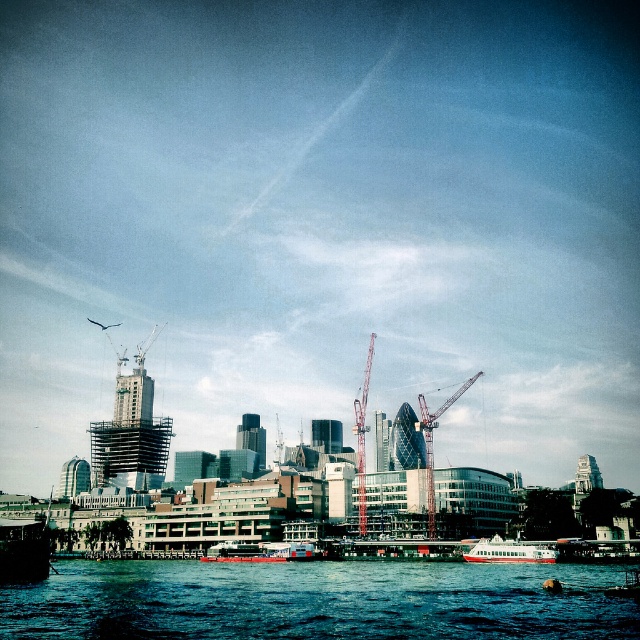
Question: Which point is closer to the camera?

Choices:
 (A) (634, 579)
 (B) (429, 440)
 (C) (509, 545)
 (D) (237, 608)

Answer: (D)

Question: Is white glossy boat at lower center wider than metallic silver boat at lower right?

Choices:
 (A) no
 (B) yes

Answer: (A)

Question: Is the position of metallic boat at lower left less distant than that of red painted metal boat at lower center?

Choices:
 (A) yes
 (B) no

Answer: (A)

Question: Which point is closer to the camera?

Choices:
 (A) (307, 573)
 (B) (493, 557)
 (C) (220, 561)
 (D) (358, 518)

Answer: (A)

Question: Which object is closer to the camera taking this photo?

Choices:
 (A) metallic red crane at center
 (B) metallic silver boat at lower right
 (C) metallic construction crane at center
 (D) blue water at lower center

Answer: (D)

Question: Is blue water at lower center in front of red painted metal boat at lower center?

Choices:
 (A) yes
 (B) no

Answer: (A)